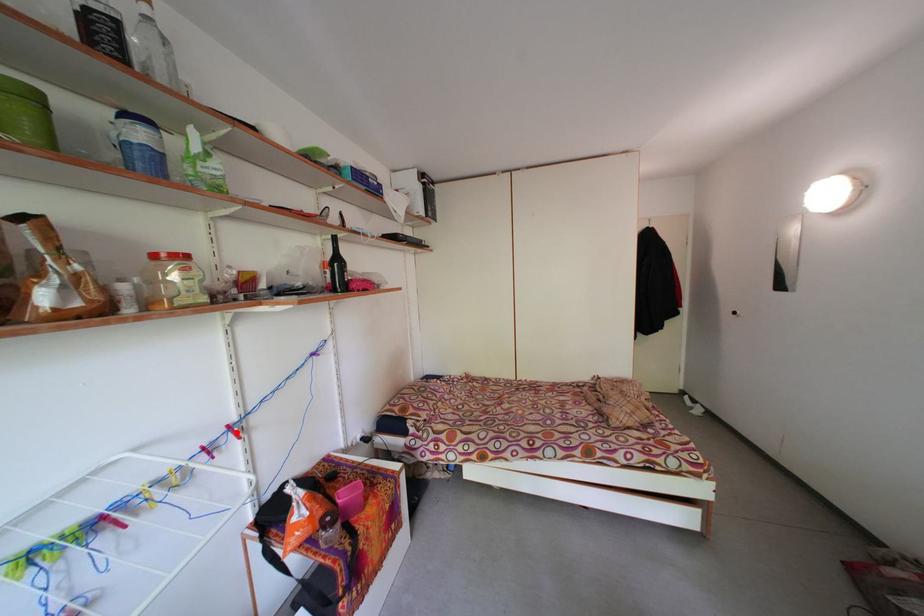
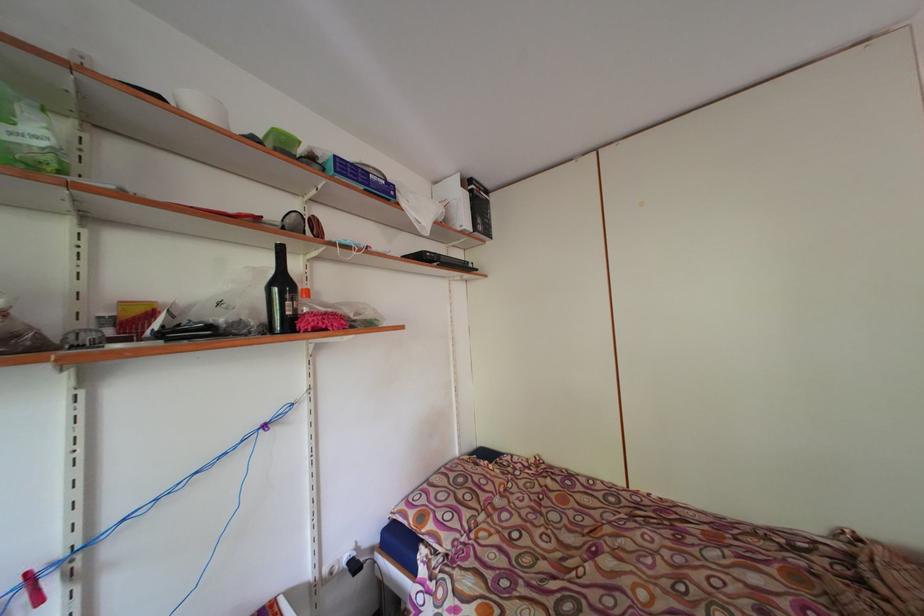
Question: I am providing you with two images of the same scene from different viewpoints. A red point is marked on the first image. Can you still see the location of the red point in image 2?

Choices:
 (A) Yes
 (B) No

Answer: (A)